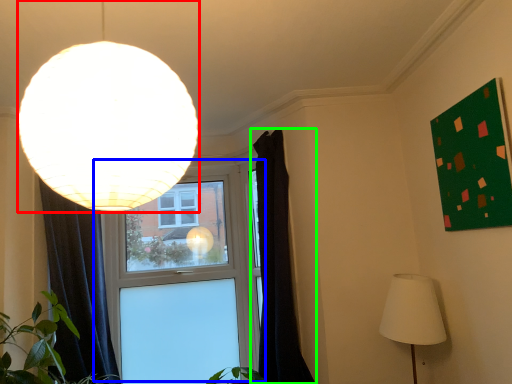
Question: Which object is the farthest from lamp (highlighted by a red box)? Choose among these: window (highlighted by a blue box) or curtain (highlighted by a green box).

Choices:
 (A) window
 (B) curtain

Answer: (A)